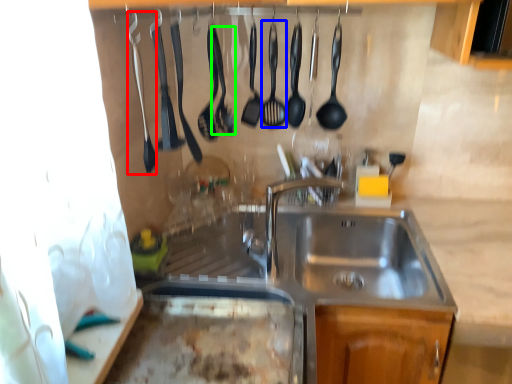
Question: Considering the real-world distances, which object is closest to silverware (highlighted by a red box)? utensil (highlighted by a blue box) or utensil (highlighted by a green box).

Choices:
 (A) utensil
 (B) utensil

Answer: (B)